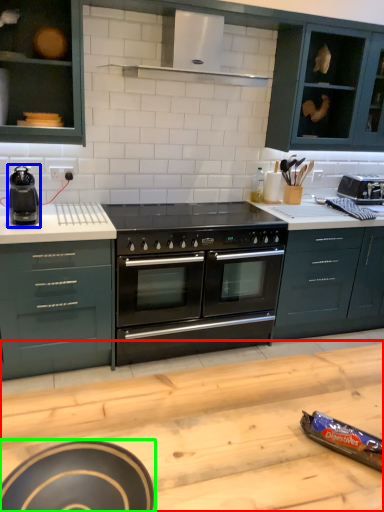
Question: Which object is the closest to the counter top (highlighted by a red box)? Choose among these: kitchen appliance (highlighted by a blue box) or appliance (highlighted by a green box).

Choices:
 (A) kitchen appliance
 (B) appliance

Answer: (B)